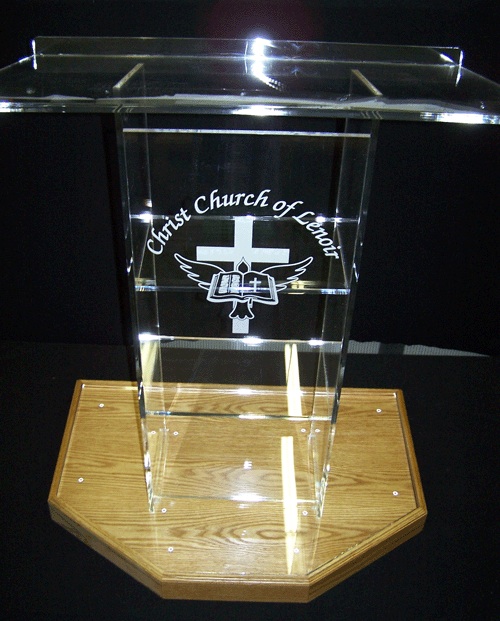
You are a GUI agent. You are given a task and a screenshot of the screen. Output one action in this format:
    pyautogui.click(x=<x>, y=<y>)
    Task: Click on the book
    The image size is (500, 621).
    Given the screenshot: What is the action you would take?
    pyautogui.click(x=242, y=284)